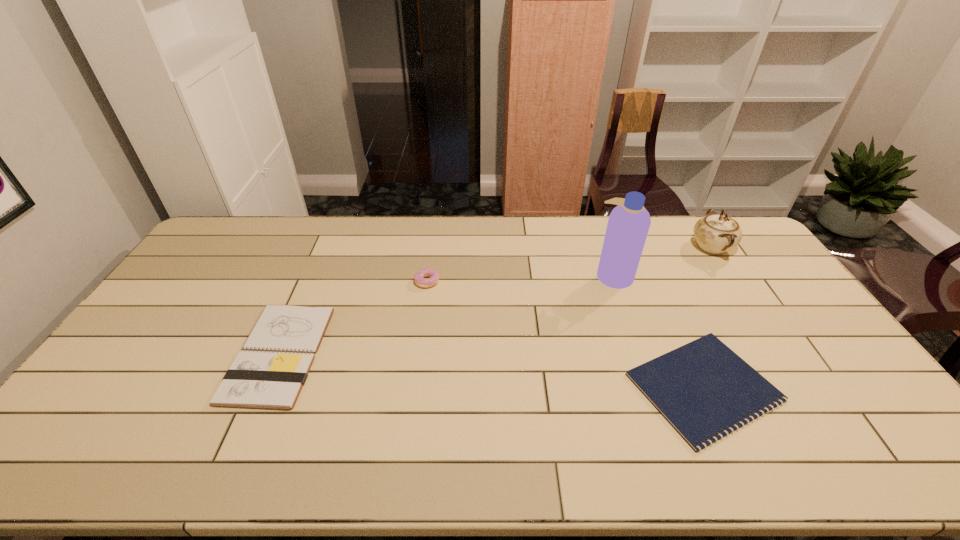
The width and height of the screenshot is (960, 540). I want to click on vacant area located on the front of the third shortest object, so click(419, 341).

Where is `vacant space located 0.110m on the left of the taller notepad`? This screenshot has height=540, width=960. vacant space located 0.110m on the left of the taller notepad is located at coordinates (199, 354).

This screenshot has height=540, width=960. I want to click on free point located 0.400m on the back of the shorter notepad, so click(x=642, y=252).

Locate an element on the screen. object that is at the far edge is located at coordinates (715, 234).

Where is `object that is at the near edge`? object that is at the near edge is located at coordinates (703, 389).

You are a GUI agent. You are given a task and a screenshot of the screen. Output one action in this format:
    pyautogui.click(x=<x>, y=<y>)
    Task: Click on the object at the right edge
    
    Given the screenshot: What is the action you would take?
    pyautogui.click(x=715, y=234)

At what (x,y) coordinates should I click in order to perform the action: click on object located in the far right corner section of the desktop. Please return your answer as a coordinate pair (x, y). This screenshot has width=960, height=540. Looking at the image, I should click on (715, 234).

You are a GUI agent. You are given a task and a screenshot of the screen. Output one action in this format:
    pyautogui.click(x=<x>, y=<y>)
    Task: Click on the free space at the far edge
    This screenshot has height=540, width=960.
    Given the screenshot: What is the action you would take?
    pyautogui.click(x=524, y=220)

Image resolution: width=960 pixels, height=540 pixels. In the image, there is a desktop. Find the location of `vacant region at the near edge`. vacant region at the near edge is located at coordinates tap(467, 471).

Locate an element on the screen. The height and width of the screenshot is (540, 960). vacant region at the left edge of the desktop is located at coordinates (211, 285).